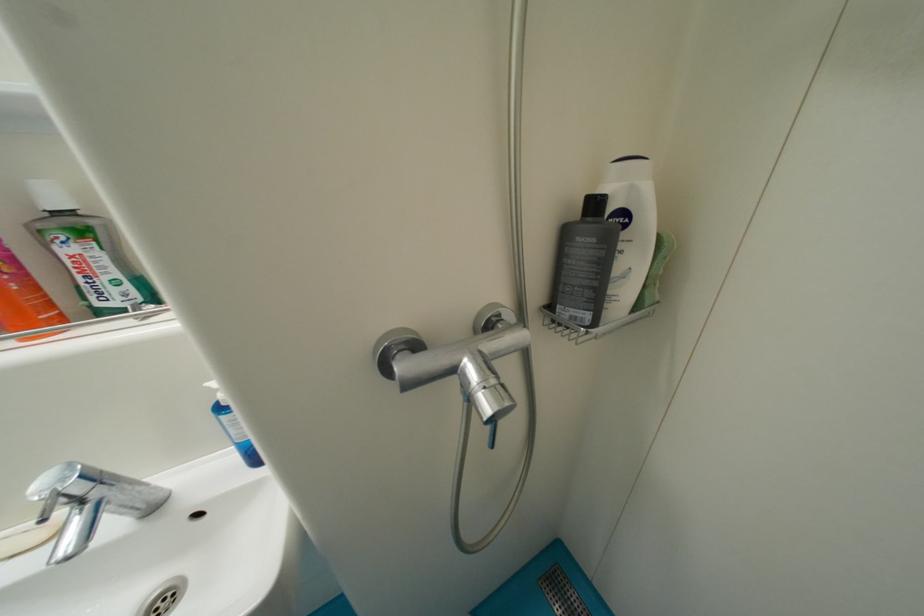
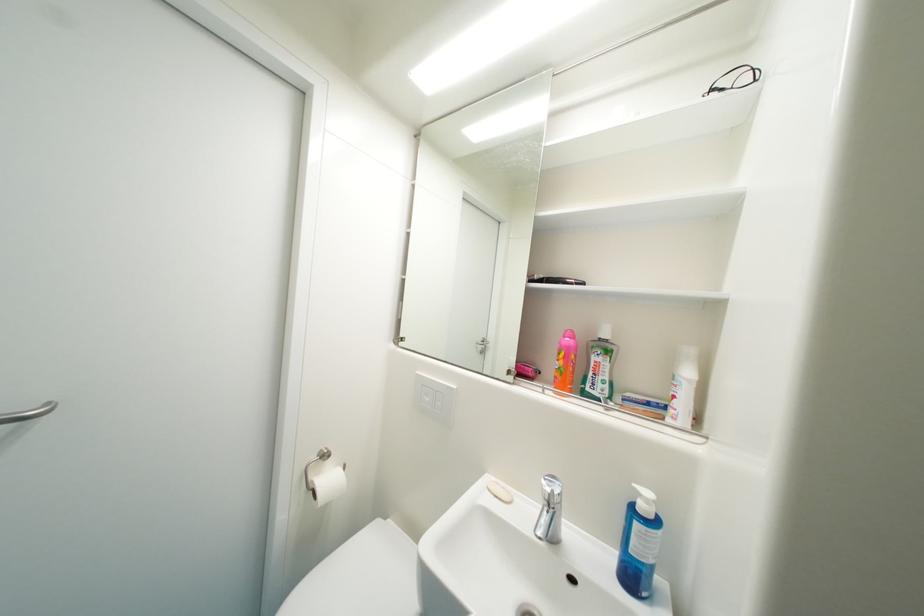
Question: The images are taken continuously from a first-person perspective. In which direction is your viewpoint rotating?

Choices:
 (A) Left
 (B) Right
 (C) Up
 (D) Down

Answer: (A)